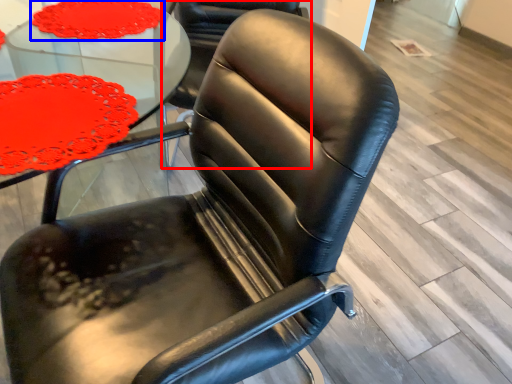
Question: Which point is further to the camera, chair (highlighted by a red box) or tablecloth (highlighted by a blue box)?

Choices:
 (A) chair
 (B) tablecloth

Answer: (A)